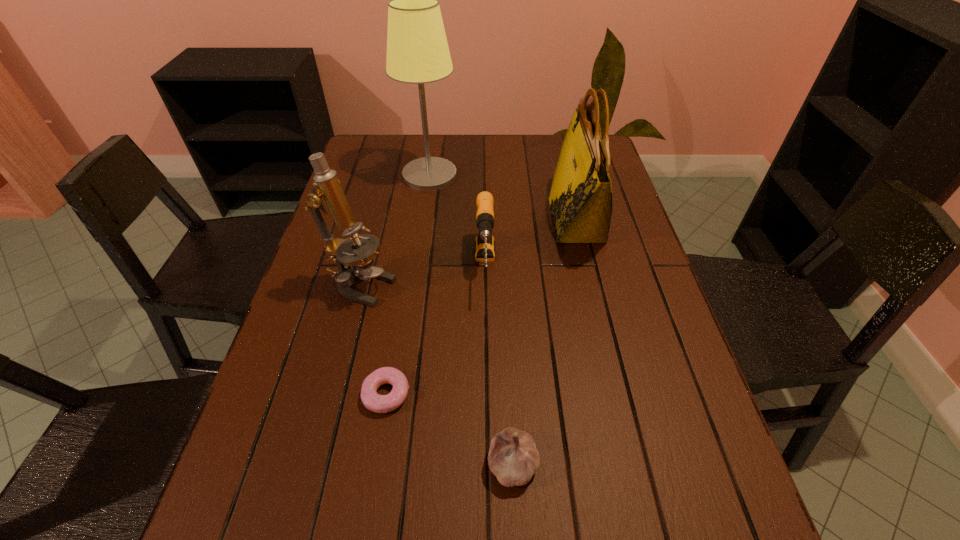
Identify the location of table lamp. Image resolution: width=960 pixels, height=540 pixels. (417, 49).

The image size is (960, 540). Identify the location of tote bag. (580, 199).

You are a GUI agent. You are given a task and a screenshot of the screen. Output one action in this format:
    pyautogui.click(x=<x>, y=<y>)
    Task: Click on the microscope
    
    Given the screenshot: What is the action you would take?
    pyautogui.click(x=353, y=261)

Locate an element on the screen. the third shortest object is located at coordinates (484, 243).

Locate an element on the screen. garlic is located at coordinates (513, 458).

You are a GUI agent. You are given a task and a screenshot of the screen. Output one action in this format:
    pyautogui.click(x=<x>, y=<y>)
    Task: Click on the nearest object
    This screenshot has width=960, height=540.
    Given the screenshot: What is the action you would take?
    pyautogui.click(x=513, y=458)

This screenshot has width=960, height=540. In order to click on the fifth farthest object in this screenshot , I will do `click(370, 398)`.

The image size is (960, 540). Identify the location of doughnut. (370, 398).

Where is `free location located on the right of the table lamp`? free location located on the right of the table lamp is located at coordinates (571, 175).

Identify the location of vacant region located on the front-facing side of the rightmost object. (487, 220).